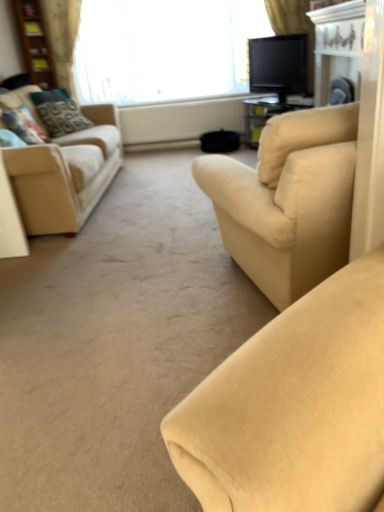
Question: From a real-world perspective, is silky beige curtain at upper center, which is counted as the 2th curtain, starting from the left, above or below white sheer curtain at upper center?

Choices:
 (A) below
 (B) above

Answer: (B)

Question: Is silky beige curtain at upper center, the 1th curtain when ordered from right to left, inside the boundaries of white sheer curtain at upper center, or outside?

Choices:
 (A) outside
 (B) inside

Answer: (A)

Question: Estimate the real-world distances between objects in this image. Which object is farther from the patterned fabric pillow at left, placed as the first pillow when sorted from back to front?

Choices:
 (A) wooden bookshelf at upper left
 (B) beige textured curtain at upper left, the 2th curtain from the right
 (C) beige fabric couch at left, which appears as the first studio couch when viewed from the back
 (D) white glossy fireplace at upper right
 (E) beige fabric couch at center, which is the 2th studio couch from left to right

Answer: (E)

Question: Which object is the closest to the beige fabric couch at center, acting as the 2th studio couch starting from the back?

Choices:
 (A) beige fabric couch at left, the 2th studio couch positioned from the right
 (B) silky beige curtain at upper center, which is counted as the 2th curtain, starting from the left
 (C) white sheer curtain at upper center
 (D) black glossy tv at upper right
 (E) white textured radiator at center

Answer: (A)